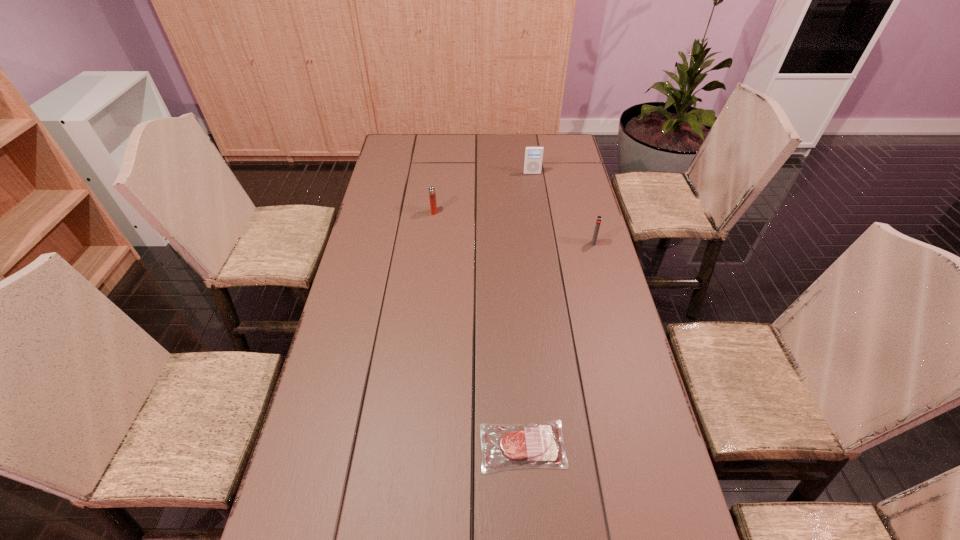
You are a GUI agent. You are given a task and a screenshot of the screen. Output one action in this format:
    pyautogui.click(x=<x>, y=<y>)
    Task: Click on the vacant space located on the left of the steak
    This screenshot has width=960, height=540.
    Given the screenshot: What is the action you would take?
    pyautogui.click(x=373, y=446)

At what (x,y) coordinates should I click in order to perform the action: click on object that is at the right edge. Please return your answer as a coordinate pair (x, y). The width and height of the screenshot is (960, 540). Looking at the image, I should click on (599, 218).

Locate an element on the screen. vacant space at the far edge of the desktop is located at coordinates (450, 145).

Identify the location of free region at the left edge of the desktop. point(413,179).

You are a GUI agent. You are given a task and a screenshot of the screen. Output one action in this format:
    pyautogui.click(x=<x>, y=<y>)
    Task: Click on the free region at the right edge of the desktop
    
    Given the screenshot: What is the action you would take?
    pyautogui.click(x=633, y=483)

Image resolution: width=960 pixels, height=540 pixels. In order to click on vacant space at the far left corner of the desktop in this screenshot , I will do `click(389, 152)`.

Where is `vacant area between the left igniter and the iPod`? vacant area between the left igniter and the iPod is located at coordinates (483, 193).

Where is `free space between the nearest object and the farther igniter`? Image resolution: width=960 pixels, height=540 pixels. free space between the nearest object and the farther igniter is located at coordinates (478, 329).

The width and height of the screenshot is (960, 540). Identify the location of vacant area that lies between the third farthest object and the steak. (558, 345).

Identify the location of unoccupied area between the third farthest object and the second farthest object. The height and width of the screenshot is (540, 960). (514, 227).